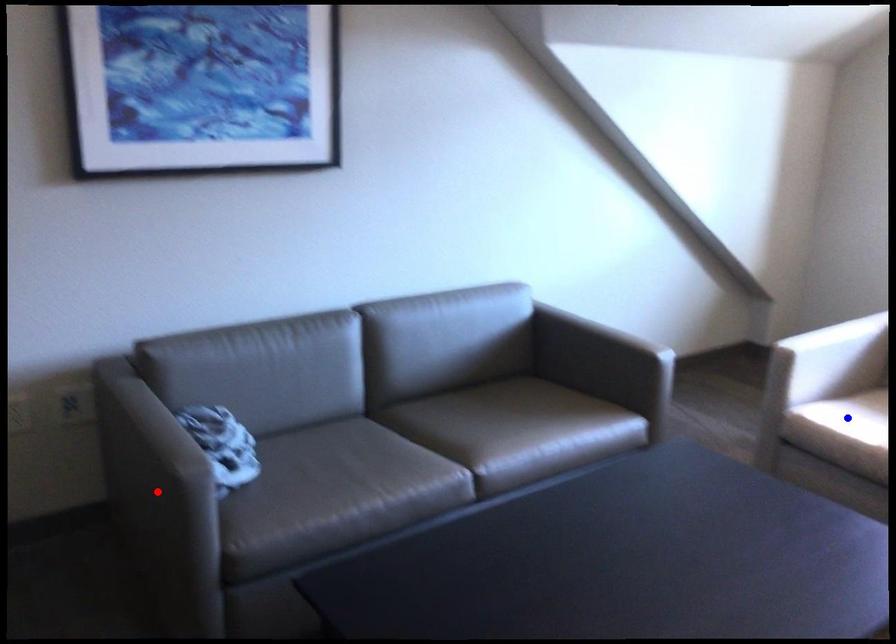
Question: Which of the two points in the image is closer to the camera?

Choices:
 (A) Blue point is closer.
 (B) Red point is closer.

Answer: (B)